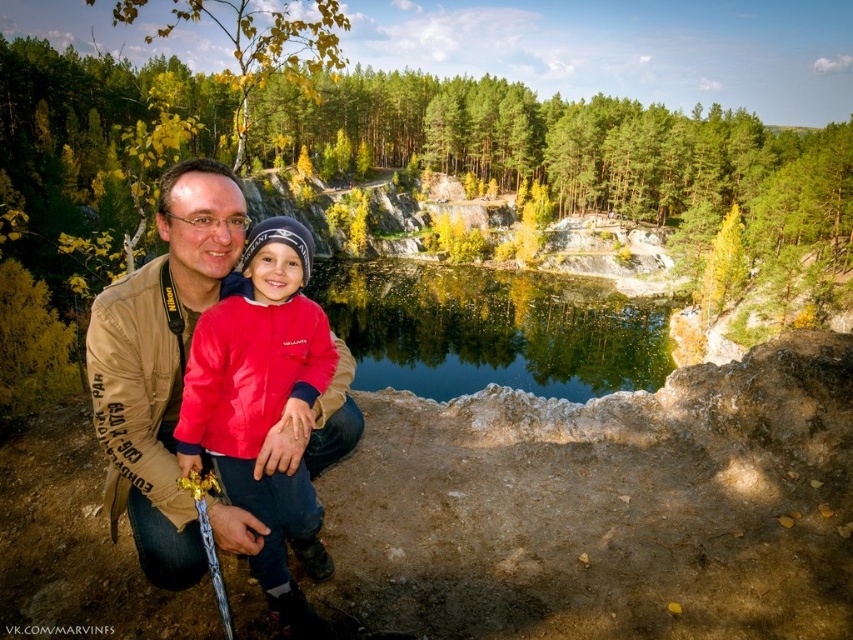
You are a photographer trying to decide which red jacket to wear for an outdoor shoot. You have two options in the scene. The first is the red fleece jacket at center, and the second is the matte red jacket at center. Based on the image, which jacket would you choose if you want a wider silhouette?

The red fleece jacket at center has a larger width than the matte red jacket at center, so choosing the red fleece jacket at center would provide a wider silhouette.

You are standing at the center of the image and want to take a photo of the red fleece jacket at center. Where should you aim your camera to capture the point at coordinates (264, 406)?

The point at coordinates (264, 406) is located on the red fleece jacket at center, so aim your camera directly at the red fleece jacket at center to capture that point.